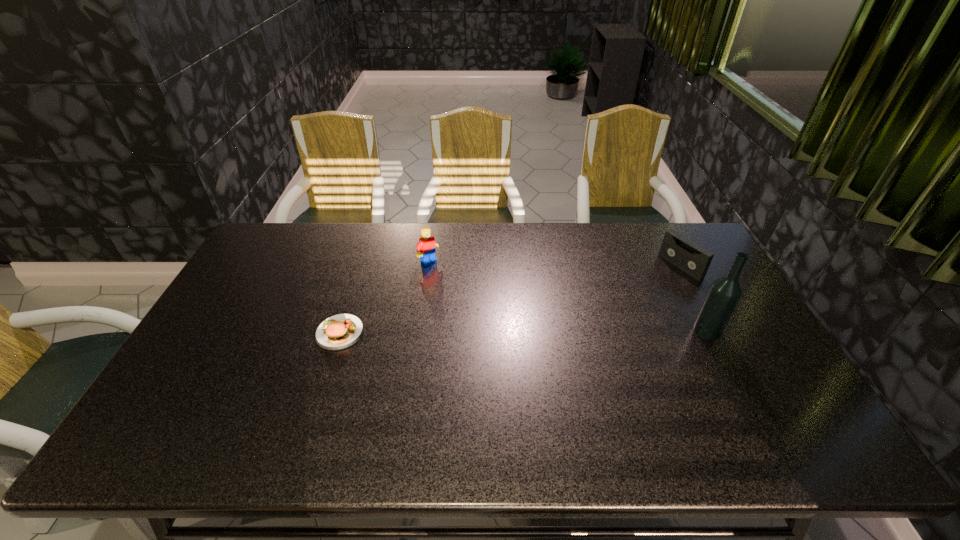
In order to click on vacant space at the near edge in this screenshot , I will do `click(476, 396)`.

In the image, there is a desktop. Identify the location of free space at the right edge. (761, 346).

Locate an element on the screen. This screenshot has height=540, width=960. vacant space at the near left corner is located at coordinates (155, 415).

Where is `free space that is in between the second object from left to right and the leftmost object`? The width and height of the screenshot is (960, 540). free space that is in between the second object from left to right and the leftmost object is located at coordinates (384, 297).

I want to click on empty location between the patty and the tallest object, so click(x=523, y=332).

Where is `free space between the second tallest object and the videotape`? This screenshot has width=960, height=540. free space between the second tallest object and the videotape is located at coordinates (555, 264).

Where is `free spot between the third tallest object and the patty`? free spot between the third tallest object and the patty is located at coordinates (510, 299).

At what (x,y) coordinates should I click in order to perform the action: click on free spot between the patty and the vodka. Please return your answer as a coordinate pair (x, y). Looking at the image, I should click on (523, 332).

The height and width of the screenshot is (540, 960). I want to click on free point between the tallest object and the third object from right to left, so click(x=567, y=296).

Identify the location of unoccupied area between the tallest object and the second shortest object. The image size is (960, 540). (693, 299).